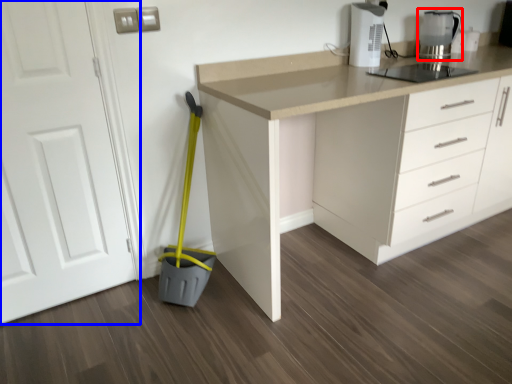
Question: Among these objects, which one is nearest to the camera, kitchen appliance (highlighted by a red box) or door (highlighted by a blue box)?

Choices:
 (A) kitchen appliance
 (B) door

Answer: (B)